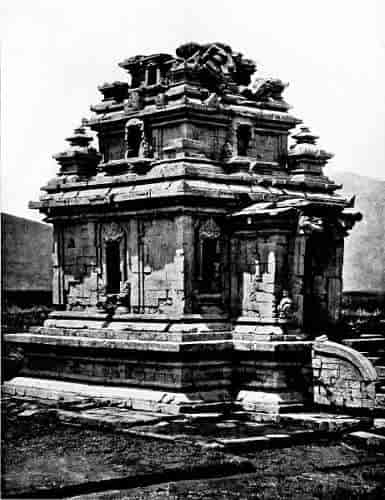
Locate an element on the screen. This screenshot has width=385, height=500. window is located at coordinates (142, 75), (107, 269), (220, 260), (248, 128), (132, 143).